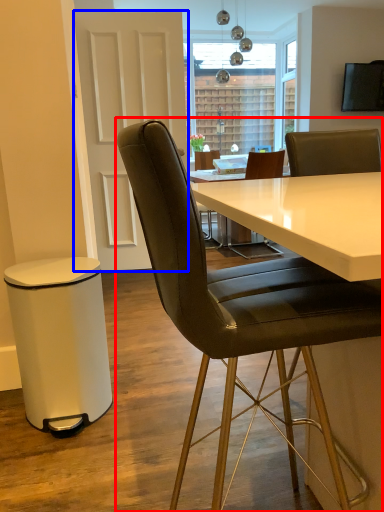
Question: Which object appears farthest to the camera in this image, chair (highlighted by a red box) or glass door (highlighted by a blue box)?

Choices:
 (A) chair
 (B) glass door

Answer: (B)